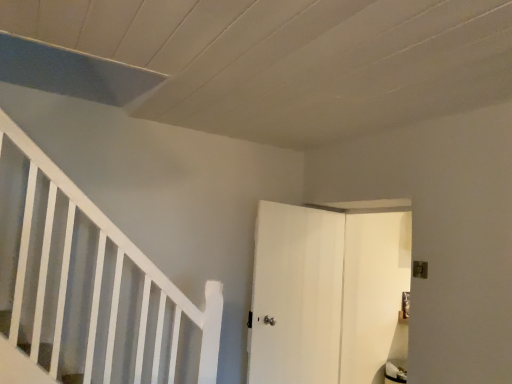
Describe the element at coordinates (45, 355) in the screenshot. I see `smooth gray stair at lower left` at that location.

What do you see at coordinates (374, 294) in the screenshot?
I see `white matte door at center, the first door when ordered from right to left` at bounding box center [374, 294].

The height and width of the screenshot is (384, 512). Describe the element at coordinates (327, 294) in the screenshot. I see `white matte door at center, which is counted as the second door, starting from the right` at that location.

Identify the location of smooth gray stair at lower left. (45, 355).

Between white matte door at center, the first door when ordered from right to left, and smooth gray stair at lower left, which one has more height?

With more height is white matte door at center, the first door when ordered from right to left.

Is white matte door at center, positioned as the 2th door in left-to-right order, oriented away from smooth gray stair at lower left?

white matte door at center, positioned as the 2th door in left-to-right order, does not have its back to smooth gray stair at lower left.

Based on the photo, from a real-world perspective, between white matte door at center, the first door when ordered from right to left, and smooth gray stair at lower left, who is vertically lower?

smooth gray stair at lower left.

Is white matte door at center, the first door when ordered from right to left, behind smooth gray stair at lower left?

Yes, white matte door at center, the first door when ordered from right to left, is further from the camera.

Considering the relative sizes of white matte door at center, the first door when ordered from right to left, and white matte door at center, which is counted as the second door, starting from the right, in the image provided, is white matte door at center, the first door when ordered from right to left, bigger than white matte door at center, which is counted as the second door, starting from the right,?

Correct, white matte door at center, the first door when ordered from right to left, is larger in size than white matte door at center, which is counted as the second door, starting from the right.

In the scene shown: From a real-world perspective, who is located higher, white matte door at center, the first door when ordered from right to left, or white matte door at center, which is counted as the second door, starting from the right?

white matte door at center, the first door when ordered from right to left, is physically above.

Could you measure the distance between white matte door at center, the first door when ordered from right to left, and white matte door at center, which is counted as the second door, starting from the right?

They are 5.72 inches apart.

Considering the relative positions of white matte door at center, the first door when ordered from right to left, and white matte door at center, which is counted as the second door, starting from the right, in the image provided, is white matte door at center, the first door when ordered from right to left, to the right of white matte door at center, which is counted as the second door, starting from the right, from the viewer's perspective?

Yes.

Is white matte door at center, which ranks as the 1th door in left-to-right order, located outside white matte door at center, the first door when ordered from right to left?

Yes, white matte door at center, which ranks as the 1th door in left-to-right order, is outside of white matte door at center, the first door when ordered from right to left.

In terms of size, does white matte door at center, which is counted as the second door, starting from the right, appear bigger or smaller than white matte door at center, the first door when ordered from right to left?

In the image, white matte door at center, which is counted as the second door, starting from the right, appears to be smaller than white matte door at center, the first door when ordered from right to left.

Between point (366, 242) and point (377, 228), which one is positioned in front?

The point (366, 242) is closer to the camera.

Relative to white matte door at center, the first door when ordered from right to left, is white matte door at center, which is counted as the second door, starting from the right, in front or behind?

white matte door at center, which is counted as the second door, starting from the right, is positioned farther from the viewer than white matte door at center, the first door when ordered from right to left.

Who is more distant, white matte door at center, which ranks as the 1th door in left-to-right order, or smooth gray stair at lower left?

white matte door at center, which ranks as the 1th door in left-to-right order, is behind.

Is smooth gray stair at lower left completely or partially inside white matte door at center, which ranks as the 1th door in left-to-right order?

Definitely not — smooth gray stair at lower left is not inside white matte door at center, which ranks as the 1th door in left-to-right order.

Considering the sizes of objects white matte door at center, which ranks as the 1th door in left-to-right order, and smooth gray stair at lower left in the image provided, who is taller, white matte door at center, which ranks as the 1th door in left-to-right order, or smooth gray stair at lower left?

With more height is white matte door at center, which ranks as the 1th door in left-to-right order.

From a real-world perspective, is smooth gray stair at lower left over white matte door at center, the first door when ordered from right to left?

No, from a real-world perspective, smooth gray stair at lower left is not over white matte door at center, the first door when ordered from right to left

Could you tell me if smooth gray stair at lower left is facing white matte door at center, the first door when ordered from right to left?

Yes, smooth gray stair at lower left faces towards white matte door at center, the first door when ordered from right to left.

Is the position of smooth gray stair at lower left more distant than that of white matte door at center, positioned as the 2th door in left-to-right order?

No, smooth gray stair at lower left is closer to the viewer.

How many degrees apart are the facing directions of smooth gray stair at lower left and white matte door at center, positioned as the 2th door in left-to-right order?

178 degrees.

Does point (47, 367) appear closer or farther from the camera than point (335, 382)?

Point (47, 367) is closer to the camera than point (335, 382).

Considering the relative sizes of smooth gray stair at lower left and white matte door at center, which is counted as the second door, starting from the right, in the image provided, is smooth gray stair at lower left shorter than white matte door at center, which is counted as the second door, starting from the right,?

Yes.

Can you confirm if smooth gray stair at lower left is wider than white matte door at center, which ranks as the 1th door in left-to-right order?

Yes, smooth gray stair at lower left is wider than white matte door at center, which ranks as the 1th door in left-to-right order.

From the image's perspective, between smooth gray stair at lower left and white matte door at center, which ranks as the 1th door in left-to-right order, who is located below?

white matte door at center, which ranks as the 1th door in left-to-right order, appears lower in the image.

The height and width of the screenshot is (384, 512). I want to click on stairs above the white matte door at center, positioned as the 2th door in left-to-right order (from the image's perspective), so click(x=45, y=355).

You are a GUI agent. You are given a task and a screenshot of the screen. Output one action in this format:
    pyautogui.click(x=<x>, y=<y>)
    Task: Click on the door in front of the white matte door at center, which ranks as the 1th door in left-to-right order
    The height and width of the screenshot is (384, 512).
    Given the screenshot: What is the action you would take?
    pyautogui.click(x=374, y=294)

Looking at the image, which one is located further to white matte door at center, which is counted as the second door, starting from the right, white matte door at center, positioned as the 2th door in left-to-right order, or smooth gray stair at lower left?

Among the two, smooth gray stair at lower left is located further to white matte door at center, which is counted as the second door, starting from the right.

Which object lies further to the anchor point white matte door at center, positioned as the 2th door in left-to-right order, white matte door at center, which is counted as the second door, starting from the right, or smooth gray stair at lower left?

Based on the image, smooth gray stair at lower left appears to be further to white matte door at center, positioned as the 2th door in left-to-right order.

When comparing their distances from smooth gray stair at lower left, does white matte door at center, which ranks as the 1th door in left-to-right order, or white matte door at center, positioned as the 2th door in left-to-right order, seem further?

Among the two, white matte door at center, positioned as the 2th door in left-to-right order, is located further to smooth gray stair at lower left.

When comparing their distances from white matte door at center, the first door when ordered from right to left, does smooth gray stair at lower left or white matte door at center, which is counted as the second door, starting from the right, seem further?

smooth gray stair at lower left.

Looking at the image, which one is located closer to smooth gray stair at lower left, white matte door at center, positioned as the 2th door in left-to-right order, or white matte door at center, which ranks as the 1th door in left-to-right order?

white matte door at center, which ranks as the 1th door in left-to-right order, is closer to smooth gray stair at lower left.

Based on their spatial positions, is smooth gray stair at lower left or white matte door at center, the first door when ordered from right to left, closer to white matte door at center, which ranks as the 1th door in left-to-right order?

Based on the image, white matte door at center, the first door when ordered from right to left, appears to be nearer to white matte door at center, which ranks as the 1th door in left-to-right order.

Where is `door between smooth gray stair at lower left and white matte door at center, positioned as the 2th door in left-to-right order, in the horizontal direction`? The height and width of the screenshot is (384, 512). door between smooth gray stair at lower left and white matte door at center, positioned as the 2th door in left-to-right order, in the horizontal direction is located at coordinates (327, 294).